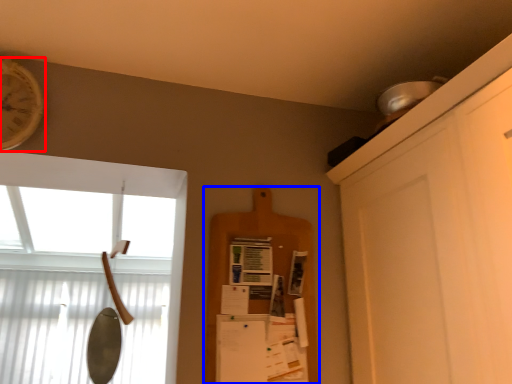
Question: Which of the following is the closest to the observer, clock (highlighted by a red box) or shelf (highlighted by a blue box)?

Choices:
 (A) clock
 (B) shelf

Answer: (A)